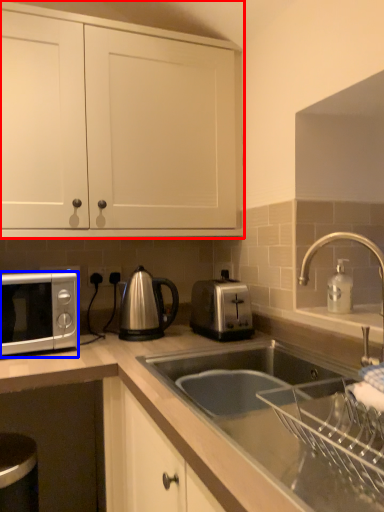
Question: Among these objects, which one is nearest to the camera, cabinetry (highlighted by a red box) or microwave oven (highlighted by a blue box)?

Choices:
 (A) cabinetry
 (B) microwave oven

Answer: (B)